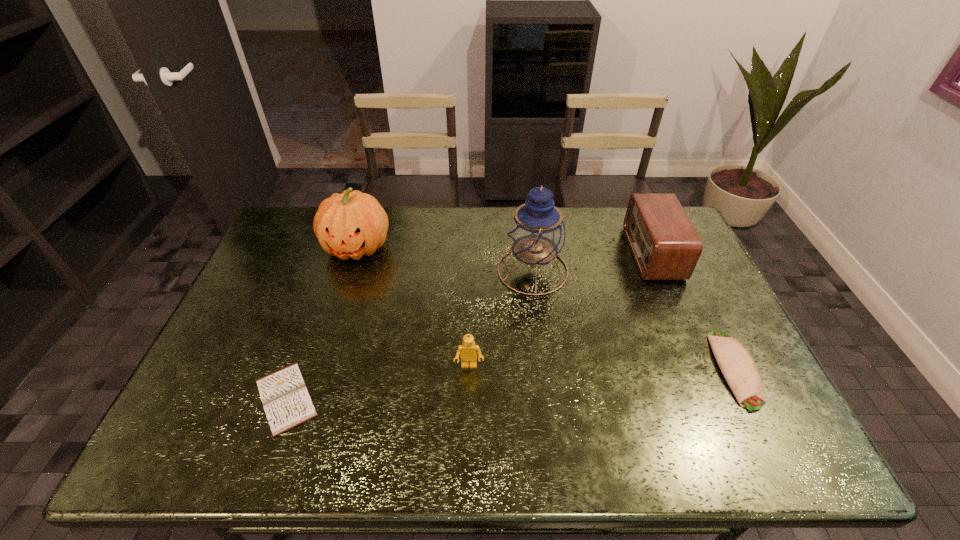
The image size is (960, 540). In order to click on lantern in this screenshot , I will do `click(536, 234)`.

Where is `the tallest object`? the tallest object is located at coordinates (536, 234).

At what (x,y) coordinates should I click in order to perform the action: click on the second tallest object. Please return your answer as a coordinate pair (x, y). Looking at the image, I should click on (352, 224).

The height and width of the screenshot is (540, 960). Identify the location of radio receiver. (665, 245).

In order to click on Lego in this screenshot , I will do `click(468, 350)`.

The width and height of the screenshot is (960, 540). I want to click on the third shortest object, so (x=468, y=350).

Image resolution: width=960 pixels, height=540 pixels. I want to click on the fifth tallest object, so click(x=739, y=369).

This screenshot has width=960, height=540. Identify the location of diary. (287, 403).

The width and height of the screenshot is (960, 540). In order to click on free space located on the front-facing side of the third object from right to left in this screenshot , I will do `click(447, 271)`.

The image size is (960, 540). Find the location of `vacant region located 0.390m on the front-facing side of the third object from right to left`. vacant region located 0.390m on the front-facing side of the third object from right to left is located at coordinates (375, 271).